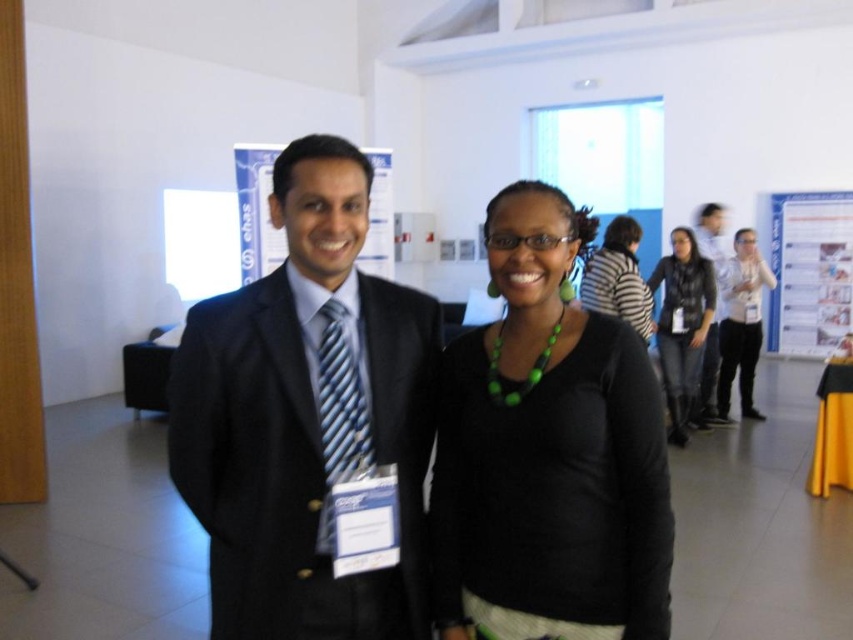
Looking at this image, which is more to the left, black matte jacket at center or matte black shirt at right?

Positioned to the left is black matte jacket at center.

Between point (679, 330) and point (747, 273), which one is positioned in front?

Point (679, 330) is in front.

Who is more distant from viewer, (616,266) or (757,314)?

Point (757,314)

Identify the location of black matte jacket at center. (682, 324).

Does matte black shirt at center have a lesser width compared to matte black shirt at right?

Yes.

Which is more to the left, matte black shirt at center or matte black shirt at right?

Positioned to the left is matte black shirt at center.

Does point (544, 404) come in front of point (730, 365)?

That is True.

Image resolution: width=853 pixels, height=640 pixels. What are the coordinates of `matte black shirt at center` in the screenshot? It's located at (548, 452).

Is point (836, 204) farther from camera compared to point (705, 424)?

Yes, it is.

Is white paperboard at upper right below white shirt at right?

Incorrect, white paperboard at upper right is not positioned below white shirt at right.

At what (x,y) coordinates should I click in order to perform the action: click on white paperboard at upper right. Please return your answer as a coordinate pair (x, y). This screenshot has width=853, height=640. Looking at the image, I should click on (809, 272).

This screenshot has height=640, width=853. Find the location of `white paperboard at upper right`. white paperboard at upper right is located at coordinates (809, 272).